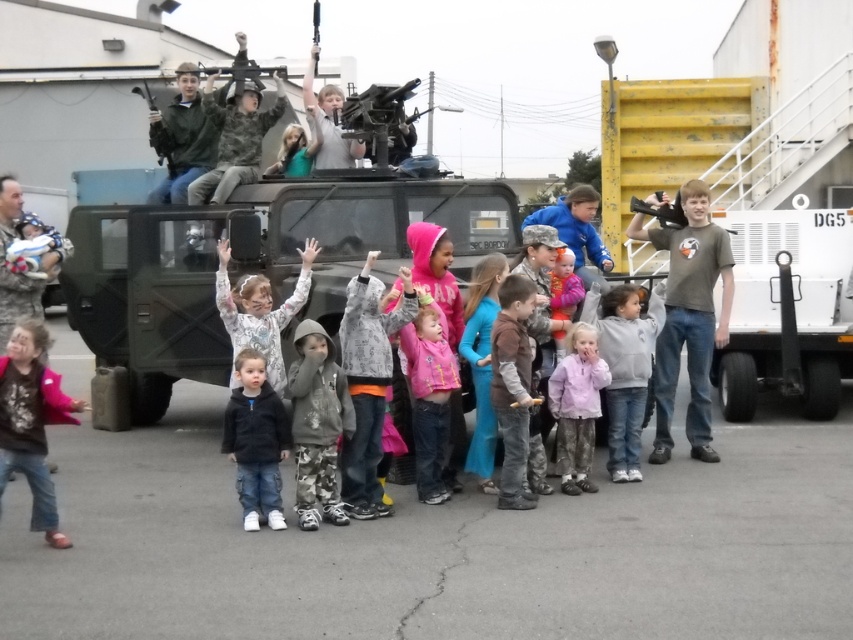
Where is the camouflage hoodie at center located in the image?

The camouflage hoodie at center is located at point (317, 422).

You are a photographer trying to capture a photo of the pink fleece jacket at center without including the camouflage hoodie at center in the frame. Based on their positions, is this possible?

The camouflage hoodie at center is to the left of the pink fleece jacket at center, so if you position yourself to the right side of the pink fleece jacket at center, you can frame the shot to exclude the camouflage hoodie at center.